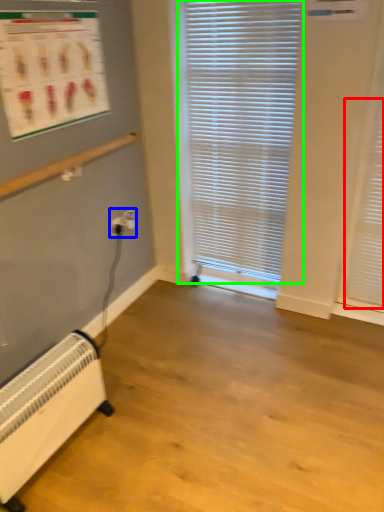
Question: Based on their relative distances, which object is nearer to shutter (highlighted by a red box)? Choose from electric outlet (highlighted by a blue box) and window blind (highlighted by a green box).

Choices:
 (A) electric outlet
 (B) window blind

Answer: (B)